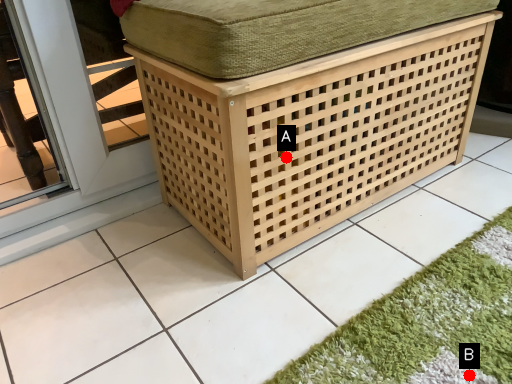
Question: Two points are circled on the image, labeled by A and B beside each circle. Which point appears farthest from the camera in this image?

Choices:
 (A) A is further
 (B) B is further

Answer: (A)